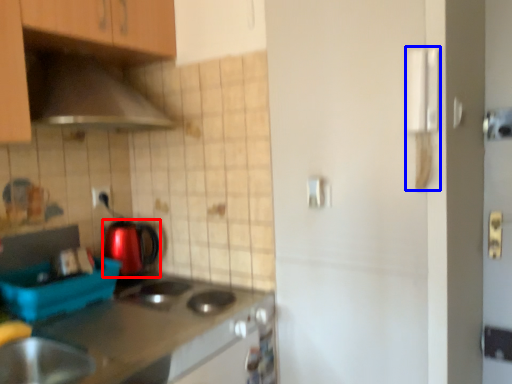
Question: Which object is further to the camera taking this photo, kitchen appliance (highlighted by a red box) or door handle (highlighted by a blue box)?

Choices:
 (A) kitchen appliance
 (B) door handle

Answer: (A)